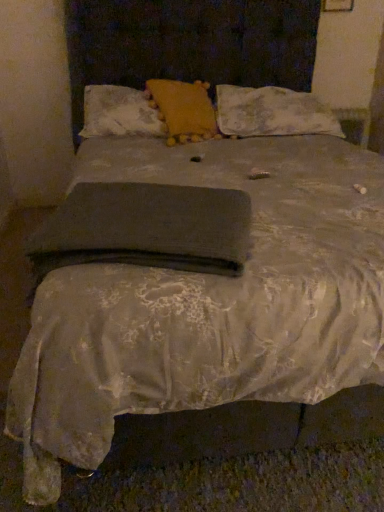
Question: Does yellow fabric pillow at center, which ranks as the 2th pillow in right-to-left order, come in front of dark gray fabric at center?

Choices:
 (A) no
 (B) yes

Answer: (A)

Question: Is yellow fabric pillow at center, which ranks as the 2th pillow in right-to-left order, surrounding dark gray fabric at center?

Choices:
 (A) yes
 (B) no

Answer: (B)

Question: Does yellow fabric pillow at center, the second pillow from the left, appear on the right side of dark gray fabric at center?

Choices:
 (A) no
 (B) yes

Answer: (B)

Question: Does yellow fabric pillow at center, the second pillow from the left, have a lesser height compared to dark gray fabric at center?

Choices:
 (A) yes
 (B) no

Answer: (B)

Question: Is yellow fabric pillow at center, the second pillow from the left, thinner than dark gray fabric at center?

Choices:
 (A) yes
 (B) no

Answer: (A)

Question: Is yellow fabric pillow at center, the second pillow from the left, situated inside dark gray fabric at center or outside?

Choices:
 (A) inside
 (B) outside

Answer: (B)

Question: Visually, is yellow fabric pillow at center, which ranks as the 2th pillow in right-to-left order, positioned to the left or to the right of dark gray fabric at center?

Choices:
 (A) left
 (B) right

Answer: (B)

Question: Considering the positions of yellow fabric pillow at center, the second pillow from the left, and dark gray fabric at center in the image, is yellow fabric pillow at center, the second pillow from the left, wider or thinner than dark gray fabric at center?

Choices:
 (A) wide
 (B) thin

Answer: (B)

Question: Considering the positions of point (167, 136) and point (238, 238), is point (167, 136) closer or farther from the camera than point (238, 238)?

Choices:
 (A) closer
 (B) farther

Answer: (B)

Question: Is yellow fabric pillow at center, which ranks as the 2th pillow in right-to-left order, inside or outside of floral lace pillow at upper right, the 1th pillow when ordered from right to left?

Choices:
 (A) inside
 (B) outside

Answer: (B)

Question: In the image, is yellow fabric pillow at center, which ranks as the 2th pillow in right-to-left order, positioned in front of or behind floral lace pillow at upper right, which appears as the 3th pillow when viewed from the left?

Choices:
 (A) front
 (B) behind

Answer: (A)

Question: From their relative heights in the image, would you say yellow fabric pillow at center, the second pillow from the left, is taller or shorter than floral lace pillow at upper right, which appears as the 3th pillow when viewed from the left?

Choices:
 (A) tall
 (B) short

Answer: (A)

Question: From a real-world perspective, is yellow fabric pillow at center, the second pillow from the left, positioned above or below floral lace pillow at upper right, the 1th pillow when ordered from right to left?

Choices:
 (A) above
 (B) below

Answer: (A)

Question: Would you say floral lace pillow at upper right, which appears as the 3th pillow when viewed from the left, is to the left or to the right of yellow fabric pillow at center, the second pillow from the left, in the picture?

Choices:
 (A) left
 (B) right

Answer: (B)

Question: In terms of size, does floral lace pillow at upper right, which appears as the 3th pillow when viewed from the left, appear bigger or smaller than yellow fabric pillow at center, which ranks as the 2th pillow in right-to-left order?

Choices:
 (A) big
 (B) small

Answer: (A)